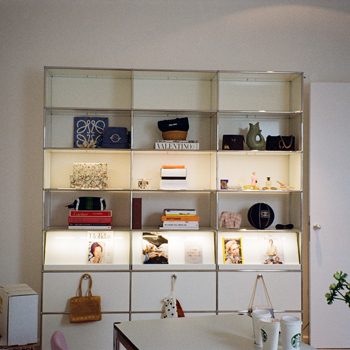
Where is `stack of books`? The image size is (350, 350). stack of books is located at coordinates (186, 216).